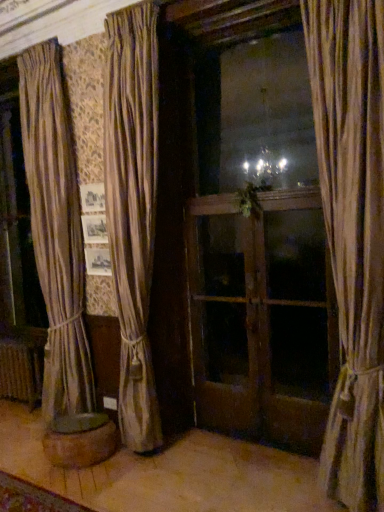
The width and height of the screenshot is (384, 512). I want to click on free region under silky beige curtain at center, which ranks as the 1th curtain in back-to-front order (from a real-world perspective), so click(x=167, y=448).